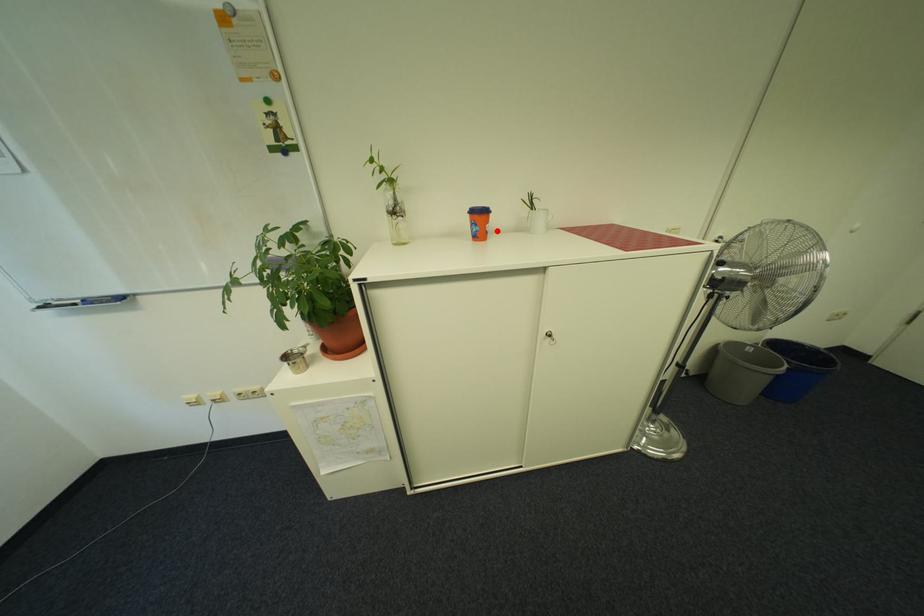
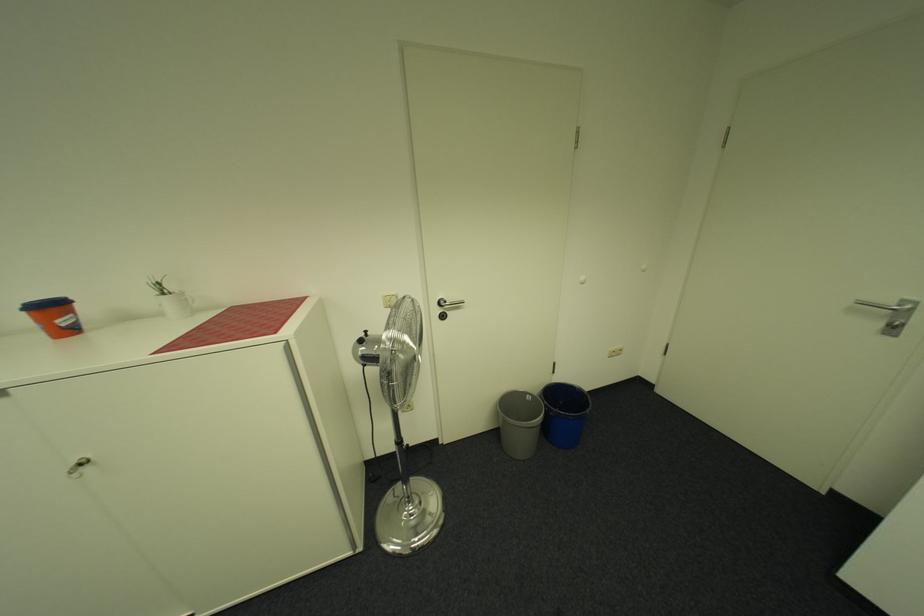
The point at the highlighted location is marked in the first image. Where is the corresponding point in the second image?

(73, 326)